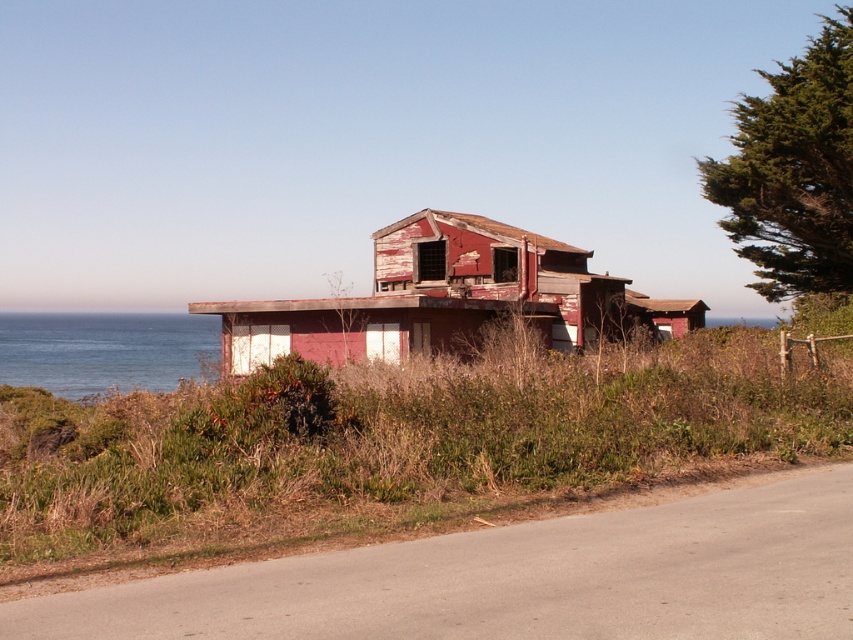
Question: Which point is closer to the camera taking this photo?

Choices:
 (A) (846, 397)
 (B) (410, 333)
 (C) (59, 316)

Answer: (A)

Question: Among these points, which one is nearest to the camera?

Choices:
 (A) (410, 314)
 (B) (206, 349)

Answer: (A)

Question: In this image, where is peeling paint wooden hut at center located relative to blue water at left?

Choices:
 (A) above
 (B) below

Answer: (A)

Question: Is peeling paint wooden hut at center wider than blue water at left?

Choices:
 (A) yes
 (B) no

Answer: (B)

Question: Can you confirm if rusty metal shack at center is positioned below blue water at left?

Choices:
 (A) yes
 (B) no

Answer: (B)

Question: Among these objects, which one is nearest to the camera?

Choices:
 (A) rusty metal shack at center
 (B) blue water at left

Answer: (A)